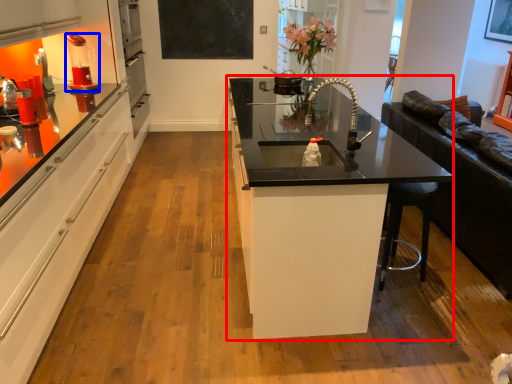
Question: Which point is closer to the camera, countertop (highlighted by a red box) or coffee machine (highlighted by a blue box)?

Choices:
 (A) countertop
 (B) coffee machine

Answer: (A)